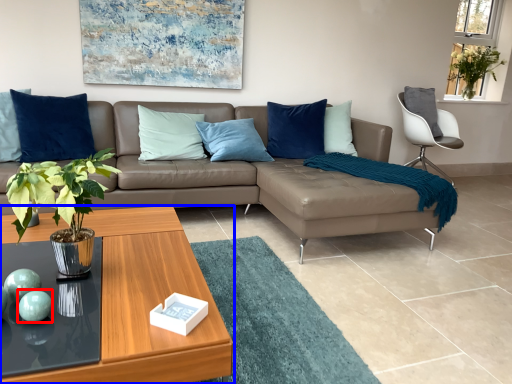
Question: Which object is further to the camera taking this photo, teal (highlighted by a red box) or coffee table (highlighted by a blue box)?

Choices:
 (A) teal
 (B) coffee table

Answer: (A)